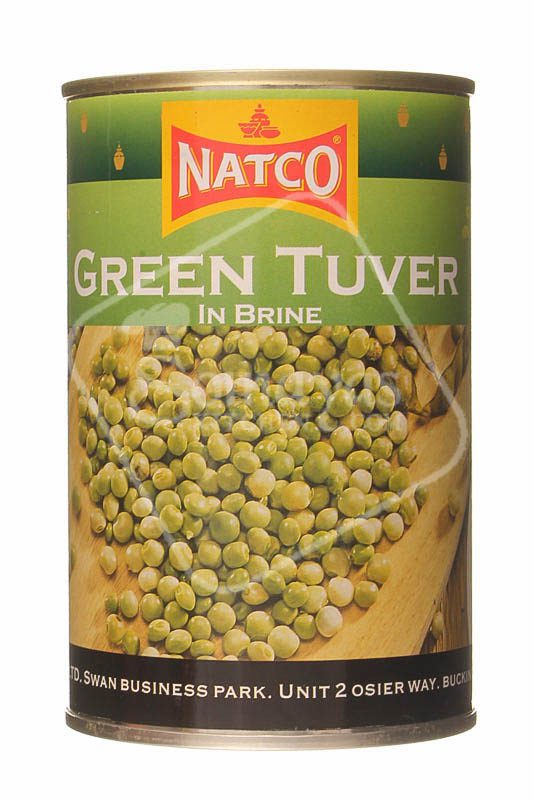
This screenshot has width=533, height=800. I want to click on wooden cutting board, so click(x=417, y=586).